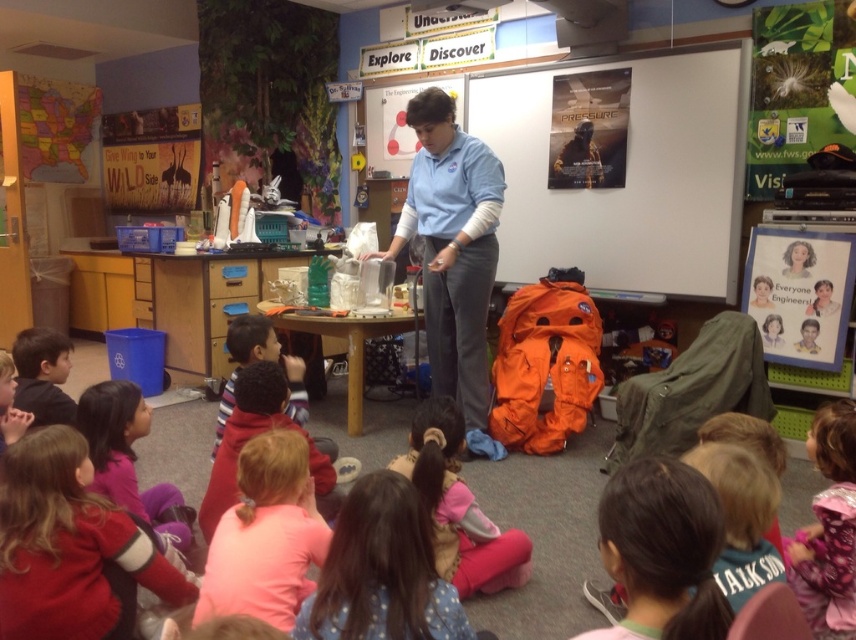
You are a photographer standing at the back of the classroom. You need to capture a photo of both the dark brown hair at lower right and the fluffy pink dress at lower right. Which object should you focus on first if you want to ensure both are in the frame?

You should focus on the fluffy pink dress at lower right first because it is taller than the dark brown hair at lower right, so adjusting the frame to include its height will also accommodate the shorter dark brown hair at lower right.

You are a student in the classroom and need to determine which object is wider between the light blue shirt at center and the light brown hair at center. Which one is wider?

The light blue shirt at center is wider than the light brown hair at center.

You are a student sitting at the front of the classroom. You need to locate the dark brown hair at lower right. Based on the coordinates provided, where should you look relative to your position?

The dark brown hair at lower right is located at coordinates point (664, 547), so you should look to your lower right direction to find it.